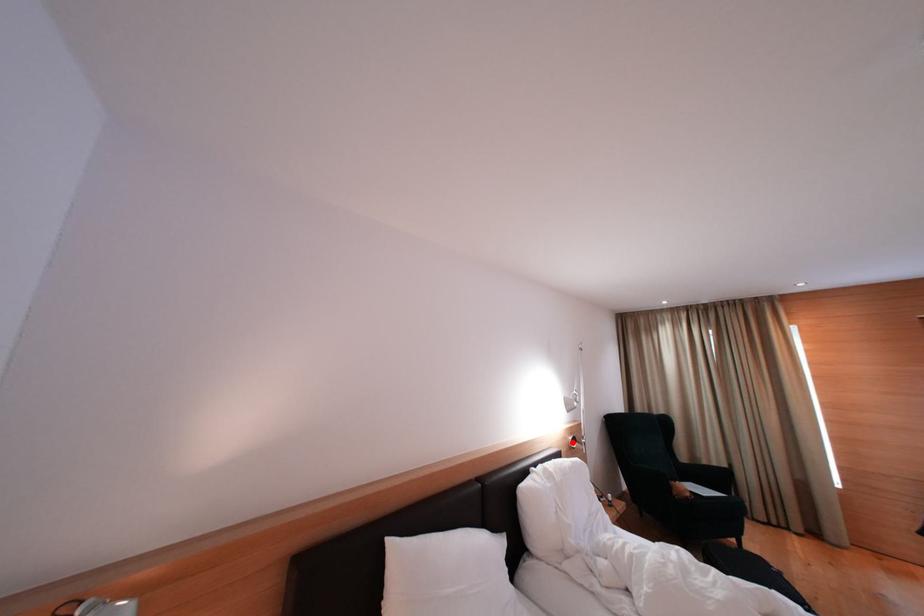
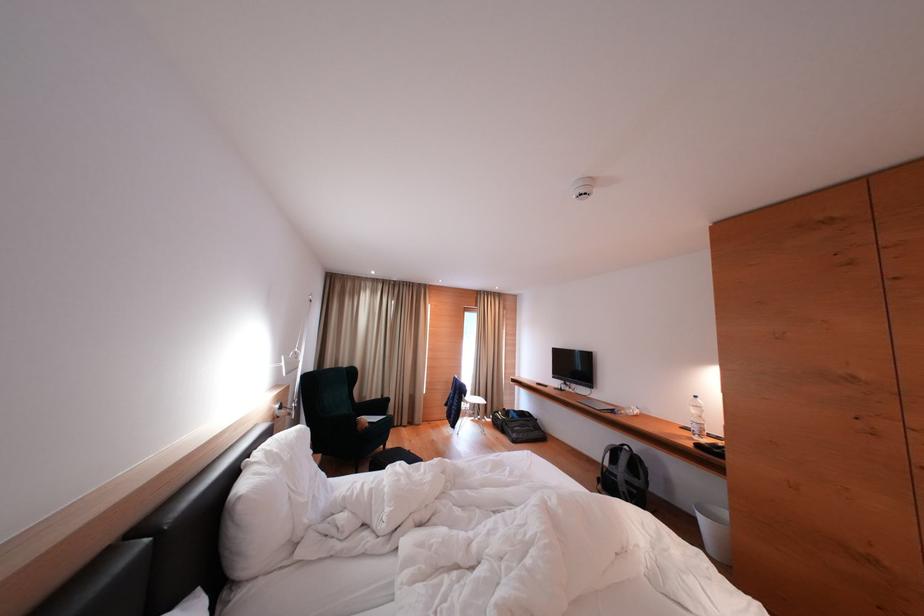
In the second image, find the point that corresponds to the highlighted location in the first image.

(277, 411)